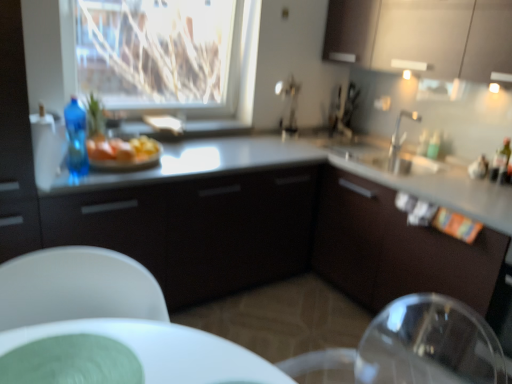
Identify the location of vacant area that is in front of yellow butter at center. The width and height of the screenshot is (512, 384). (140, 172).